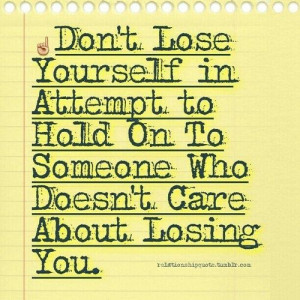
Where is `ruled light yellow notepad paper`? This screenshot has width=300, height=300. ruled light yellow notepad paper is located at coordinates (8, 30).